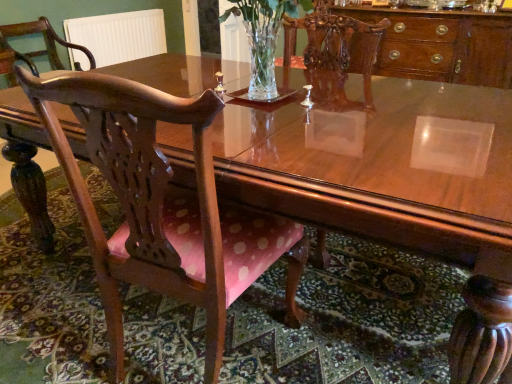
The height and width of the screenshot is (384, 512). In order to click on vacant space underneath clear glass vase at center (from a real-world perspective) in this screenshot , I will do `click(271, 97)`.